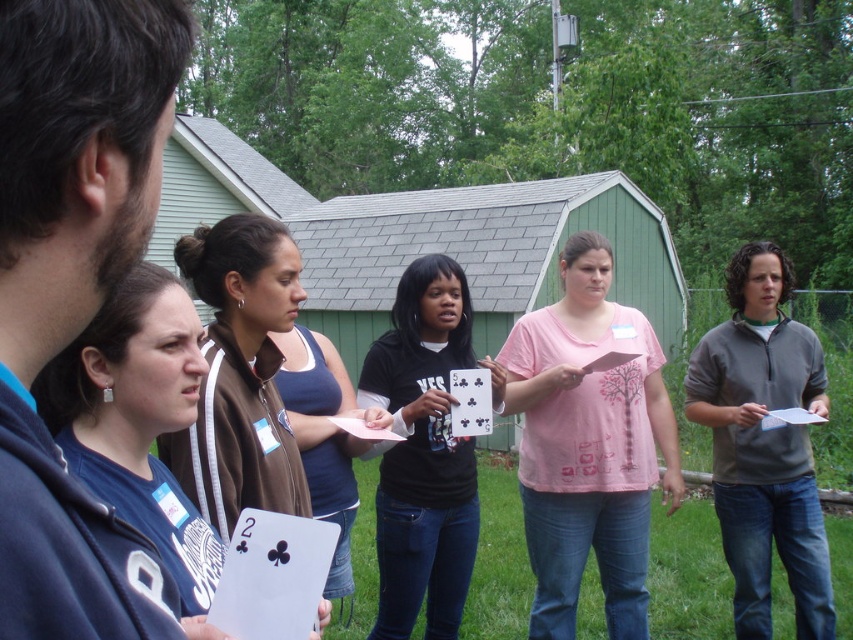
You are standing in front of the group of six people playing cards near the green shed. You notice two points marked in the scene at coordinates point (x=376, y=384) and point (x=334, y=417). Which point is closer to you?

Point (x=376, y=384) is further to the camera than point (x=334, y=417), so the point closer to you is point (x=334, y=417).

You are a photographer trying to capture a group photo of the blue fabric shirt at center and the black matte shirt at center. Since you want to ensure both are fully visible in the frame, which person should you position closer to the camera?

The blue fabric shirt at center is not as tall as black matte shirt at center, so you should position the blue fabric shirt at center closer to the camera to ensure both are fully visible in the frame.